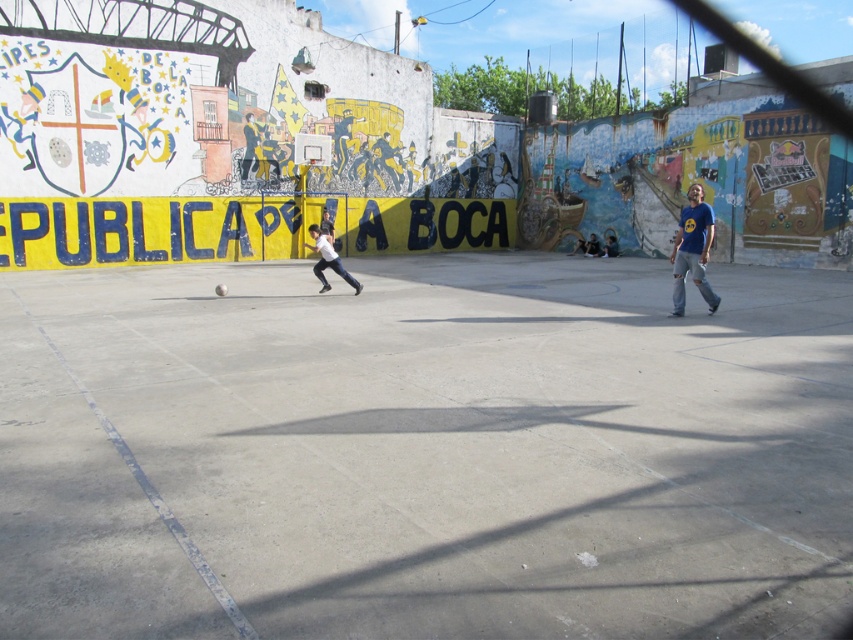
Is blue t-shirt at right shorter than white matte skateboard at center?

Yes, blue t-shirt at right is shorter than white matte skateboard at center.

Is point (688, 256) positioned before point (347, 276)?

Yes.

Image resolution: width=853 pixels, height=640 pixels. Describe the element at coordinates (692, 250) in the screenshot. I see `blue t-shirt at right` at that location.

I want to click on blue t-shirt at right, so click(692, 250).

Which is more to the left, concrete at center or white matte skateboard at center?

From the viewer's perspective, white matte skateboard at center appears more on the left side.

Between concrete at center and white matte skateboard at center, which one appears on the right side from the viewer's perspective?

concrete at center

Between point (770, 490) and point (320, 234), which one is positioned in front?

Point (770, 490) is more forward.

The width and height of the screenshot is (853, 640). Identify the location of concrete at center. (425, 451).

Can you confirm if concrete at center is bigger than blue t-shirt at right?

Yes, concrete at center is bigger than blue t-shirt at right.

Is point (45, 349) closer to viewer compared to point (701, 208)?

Yes, point (45, 349) is in front of point (701, 208).

Image resolution: width=853 pixels, height=640 pixels. Describe the element at coordinates (425, 451) in the screenshot. I see `concrete at center` at that location.

Where is `concrete at center`? concrete at center is located at coordinates (425, 451).